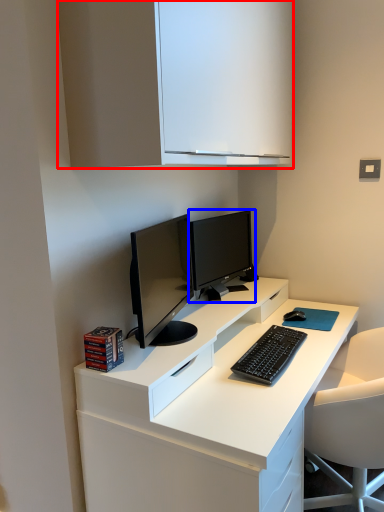
Question: Among these objects, which one is farthest to the camera, cabinetry (highlighted by a red box) or computer monitor (highlighted by a blue box)?

Choices:
 (A) cabinetry
 (B) computer monitor

Answer: (B)